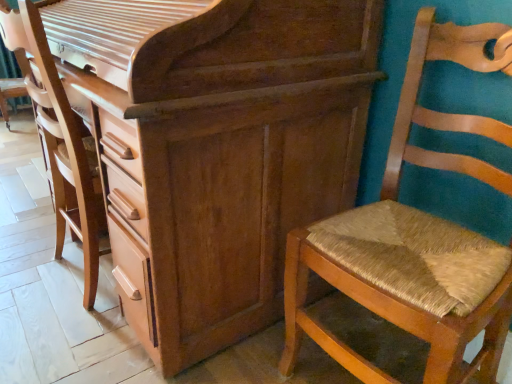
Locate an element on the screen. This screenshot has height=384, width=512. woven straw chair at right is located at coordinates pyautogui.click(x=416, y=236).

Locate an element on the screen. wooden textured swivel chair at center is located at coordinates (59, 142).

Would you say wooden textured swivel chair at center is outside wooden chest of drawers at center?

No, most part of wooden textured swivel chair at center lies within wooden chest of drawers at center.

From the image's perspective, between wooden textured swivel chair at center and wooden chest of drawers at center, which one is located above?

From the image's view, wooden chest of drawers at center is above.

What's the angular difference between wooden textured swivel chair at center and wooden chest of drawers at center's facing directions?

The angle between the facing direction of wooden textured swivel chair at center and the facing direction of wooden chest of drawers at center is 179 degrees.

Which object is further away from the camera, wooden chest of drawers at center or woven straw chair at right?

wooden chest of drawers at center.

How much distance is there between wooden chest of drawers at center and woven straw chair at right?

A distance of 13.26 inches exists between wooden chest of drawers at center and woven straw chair at right.

Is point (313, 137) closer or farther from the camera than point (498, 183)?

Point (313, 137) appears to be farther away from the viewer than point (498, 183).

From a real-world perspective, who is located lower, wooden chest of drawers at center or woven straw chair at right?

woven straw chair at right, from a real-world perspective.

Does wooden textured swivel chair at center have a greater height compared to woven straw chair at right?

No, wooden textured swivel chair at center is not taller than woven straw chair at right.

Could you tell me if wooden textured swivel chair at center is turned towards woven straw chair at right?

No, wooden textured swivel chair at center is not turned towards woven straw chair at right.

Does wooden textured swivel chair at center come behind woven straw chair at right?

Yes, it is behind woven straw chair at right.

This screenshot has height=384, width=512. I want to click on swivel chair that appears on the left of woven straw chair at right, so 59,142.

Consider the image. Would you say woven straw chair at right is to the left or to the right of wooden textured swivel chair at center in the picture?

Clearly, woven straw chair at right is on the right of wooden textured swivel chair at center in the image.

Is woven straw chair at right next to wooden textured swivel chair at center?

There is a gap between woven straw chair at right and wooden textured swivel chair at center.

Between woven straw chair at right and wooden textured swivel chair at center, which one has more height?

woven straw chair at right.

In the scene shown: From the image's perspective, which is above, wooden chest of drawers at center or wooden textured swivel chair at center?

wooden chest of drawers at center is shown above in the image.

From a real-world perspective, is wooden chest of drawers at center on wooden textured swivel chair at center?

Yes.

Based on the photo, visually, is wooden chest of drawers at center positioned to the left or to the right of wooden textured swivel chair at center?

From the image, it's evident that wooden chest of drawers at center is to the right of wooden textured swivel chair at center.

Looking at their sizes, would you say wooden chest of drawers at center is wider or thinner than wooden textured swivel chair at center?

Clearly, wooden chest of drawers at center has more width compared to wooden textured swivel chair at center.

Considering the sizes of objects woven straw chair at right and wooden chest of drawers at center in the image provided, who is shorter, woven straw chair at right or wooden chest of drawers at center?

Standing shorter between the two is woven straw chair at right.

The image size is (512, 384). I want to click on chest of drawers behind the woven straw chair at right, so click(215, 147).

Is woven straw chair at right oriented away from wooden chest of drawers at center?

No, wooden chest of drawers at center is not at the back of woven straw chair at right.

Looking at the image, does woven straw chair at right seem bigger or smaller compared to wooden chest of drawers at center?

Considering their sizes, woven straw chair at right takes up less space than wooden chest of drawers at center.

Where is `swivel chair located behind the wooden chest of drawers at center`? This screenshot has width=512, height=384. swivel chair located behind the wooden chest of drawers at center is located at coordinates (59, 142).

What are the coordinates of `chair beneath the wooden chest of drawers at center (from a real-world perspective)` in the screenshot? It's located at (416, 236).

Considering their positions, is wooden chest of drawers at center positioned closer to woven straw chair at right than wooden textured swivel chair at center?

wooden chest of drawers at center is positioned closer to the anchor woven straw chair at right.

Which object lies nearer to the anchor point wooden chest of drawers at center, woven straw chair at right or wooden textured swivel chair at center?

Based on the image, woven straw chair at right appears to be nearer to wooden chest of drawers at center.

Which object lies nearer to the anchor point wooden textured swivel chair at center, wooden chest of drawers at center or woven straw chair at right?

wooden chest of drawers at center is closer to wooden textured swivel chair at center.

Estimate the real-world distances between objects in this image. Which object is closer to woven straw chair at right, wooden textured swivel chair at center or wooden chest of drawers at center?

wooden chest of drawers at center is positioned closer to the anchor woven straw chair at right.

Looking at this image, based on their spatial positions, is wooden textured swivel chair at center or woven straw chair at right further from wooden chest of drawers at center?

Based on the image, wooden textured swivel chair at center appears to be further to wooden chest of drawers at center.

Looking at the image, which one is located closer to wooden textured swivel chair at center, woven straw chair at right or wooden chest of drawers at center?

Among the two, wooden chest of drawers at center is located nearer to wooden textured swivel chair at center.

Identify the location of chest of drawers between wooden textured swivel chair at center and woven straw chair at right. The image size is (512, 384). (215, 147).